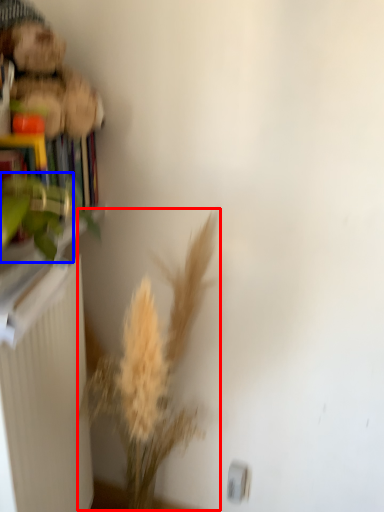
Question: Which point is further to the camera, floral arrangement (highlighted by a red box) or plant (highlighted by a blue box)?

Choices:
 (A) floral arrangement
 (B) plant

Answer: (B)